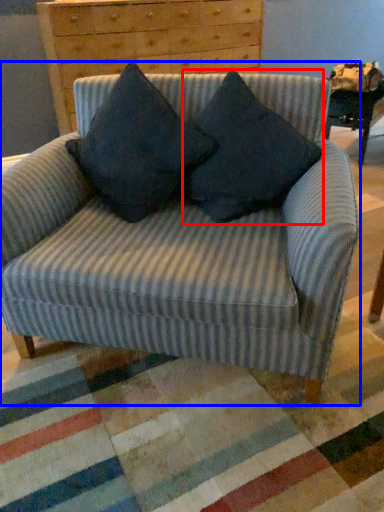
Question: Which point is further to the camera, pillow (highlighted by a red box) or chair (highlighted by a blue box)?

Choices:
 (A) pillow
 (B) chair

Answer: (A)